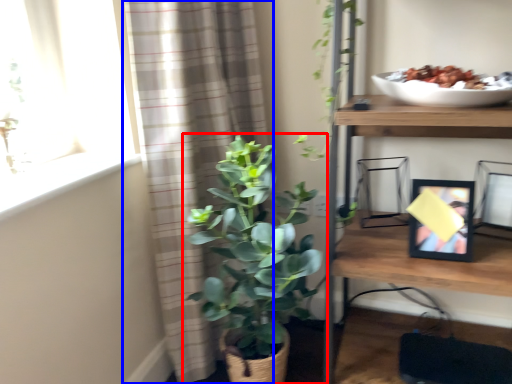
Question: Which object appears closest to the camera in this image, houseplant (highlighted by a red box) or curtain (highlighted by a blue box)?

Choices:
 (A) houseplant
 (B) curtain

Answer: (A)